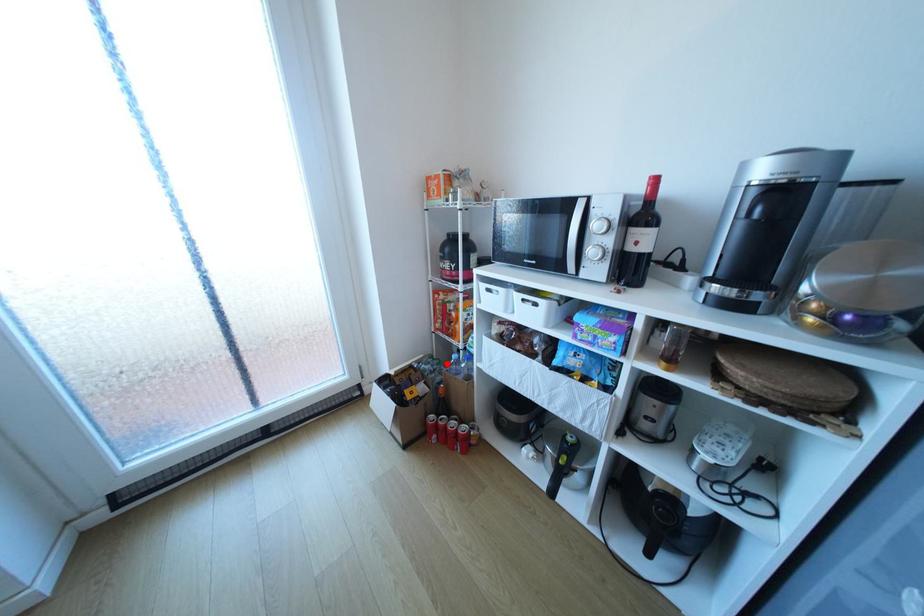
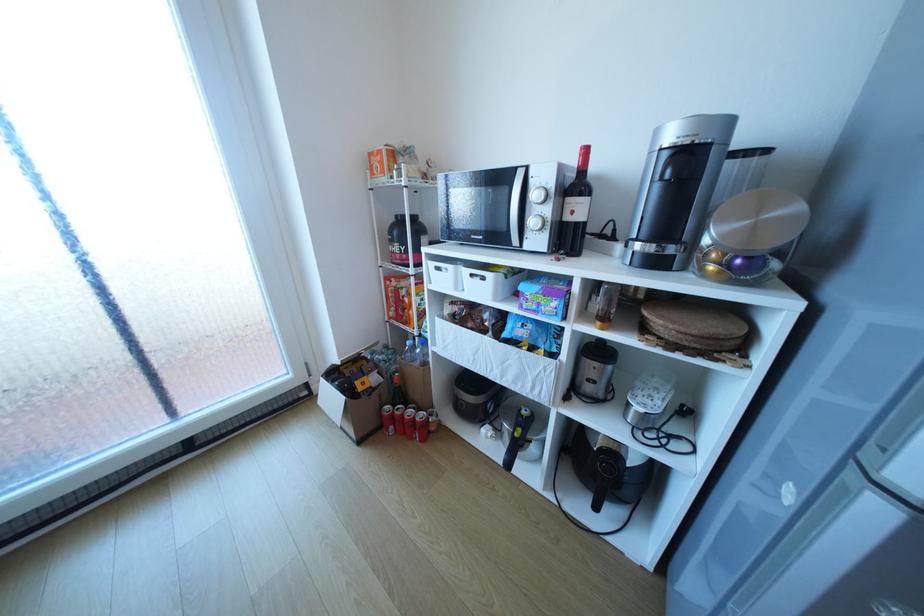
Find the pixel in the second image that matches the highlighted location in the first image.

(402, 354)